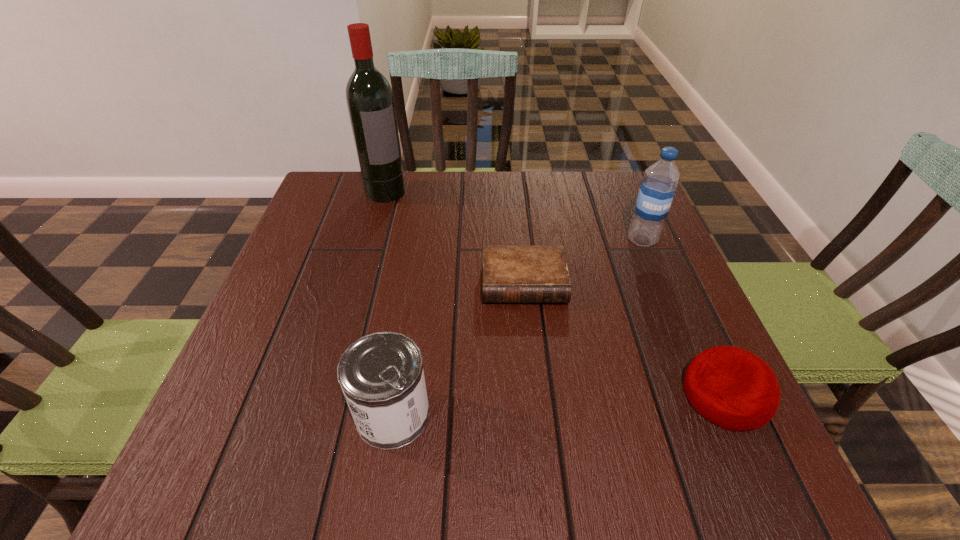
Find the location of `vacant space that is in between the third tallest object and the water bottle`. vacant space that is in between the third tallest object and the water bottle is located at coordinates (517, 327).

What are the coordinates of `free space between the diary and the beanbag` in the screenshot? It's located at click(x=624, y=339).

You are a GUI agent. You are given a task and a screenshot of the screen. Output one action in this format:
    pyautogui.click(x=<x>, y=<y>)
    Task: Click on the free space between the water bottle and the beanbag
    
    Given the screenshot: What is the action you would take?
    pyautogui.click(x=684, y=318)

The image size is (960, 540). Identify the location of free space that is in between the water bottle and the tallest object. (514, 216).

At what (x,y) coordinates should I click in order to perform the action: click on vacant space in between the farthest object and the third object from left to right. Please return your answer as a coordinate pair (x, y). The image size is (960, 540). Looking at the image, I should click on (455, 237).

This screenshot has width=960, height=540. Identify the location of object that stands as the closest to the fourth shortest object. (511, 274).

Locate which object is the second closest to the beanbag. Please provide its 2D coordinates. Your answer should be formatted as a tuple, i.e. [(x, y)], where the tuple contains the x and y coordinates of a point satisfying the conditions above.

[(657, 189)]

I want to click on vacant space that satisfies the following two spatial constraints: 1. on the front side of the third shortest object; 2. on the right side of the wine bottle, so [x=324, y=414].

This screenshot has height=540, width=960. I want to click on blank space that satisfies the following two spatial constraints: 1. on the back side of the diary; 2. on the right side of the third tallest object, so click(x=413, y=283).

Locate an element on the screen. This screenshot has height=540, width=960. vacant space that satisfies the following two spatial constraints: 1. on the front side of the fourth tallest object; 2. on the seat area of the water bottle is located at coordinates (707, 395).